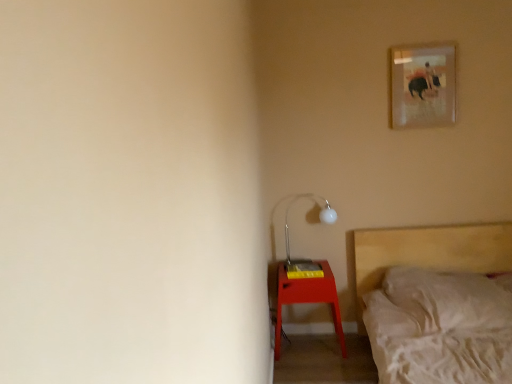
Question: From a real-world perspective, is matte red nightstand at lower right physically located above or below matte white metal table lamp at lower right?

Choices:
 (A) above
 (B) below

Answer: (B)

Question: Is matte red nightstand at lower right to the left or to the right of matte white metal table lamp at lower right in the image?

Choices:
 (A) right
 (B) left

Answer: (B)

Question: Estimate the real-world distances between objects in this image. Which object is closer to the matte white metal table lamp at lower right?

Choices:
 (A) matte glass picture frame at upper right
 (B) matte red nightstand at lower right
 (C) wooden bed at lower right

Answer: (B)

Question: Which object is positioned farthest from the matte glass picture frame at upper right?

Choices:
 (A) wooden bed at lower right
 (B) matte white metal table lamp at lower right
 (C) matte red nightstand at lower right

Answer: (C)